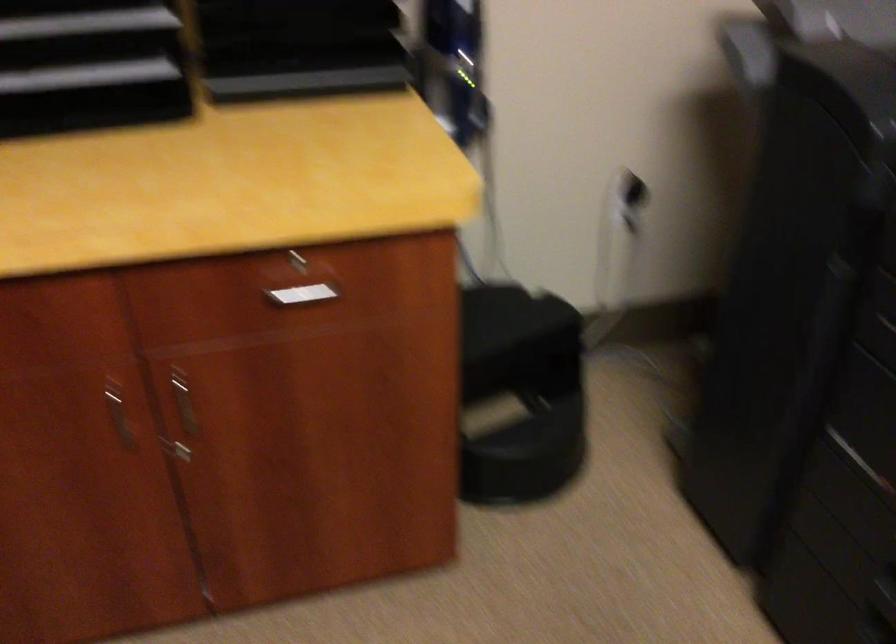
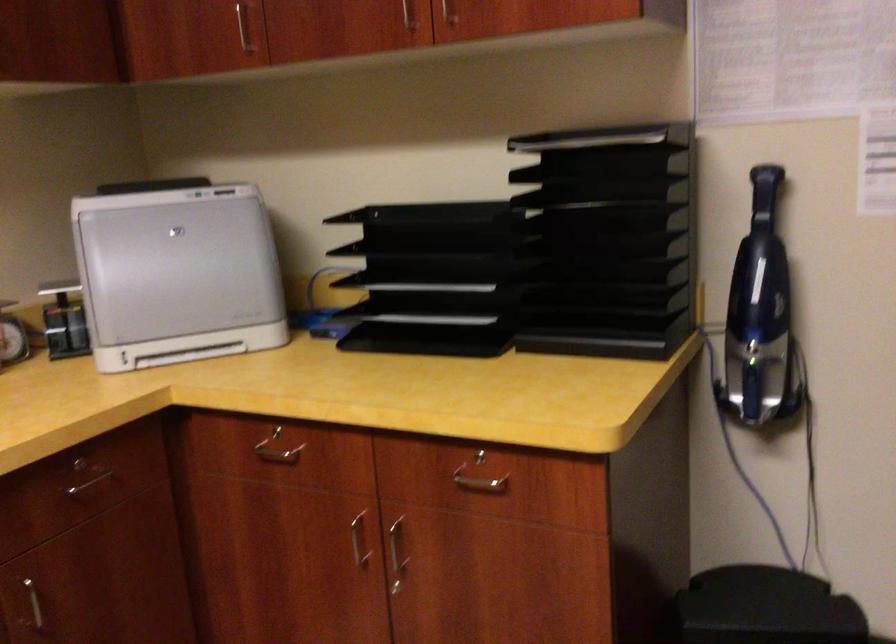
Question: The camera is either moving clockwise (left) or counter-clockwise (right) around the object. The first image is from the beginning of the video and the second image is from the end. Is the camera moving left or right when shooting the video?

Choices:
 (A) Left
 (B) Right

Answer: (B)